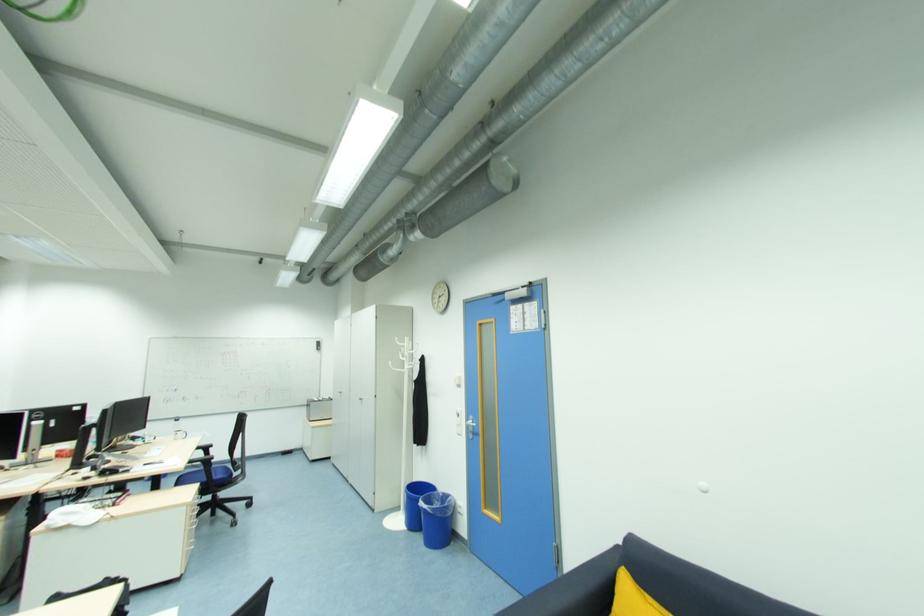
Identify the location of white coat rack hook. (405, 355).